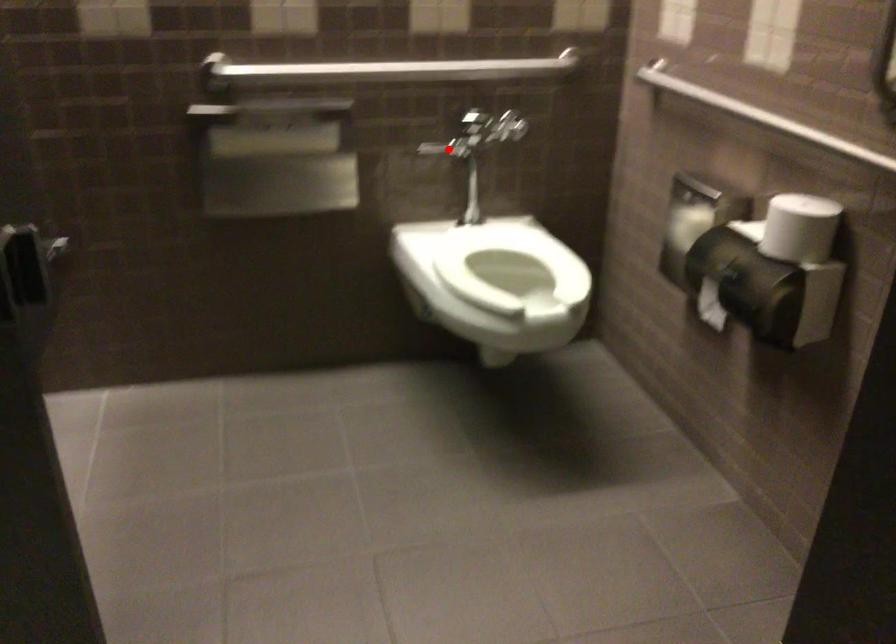
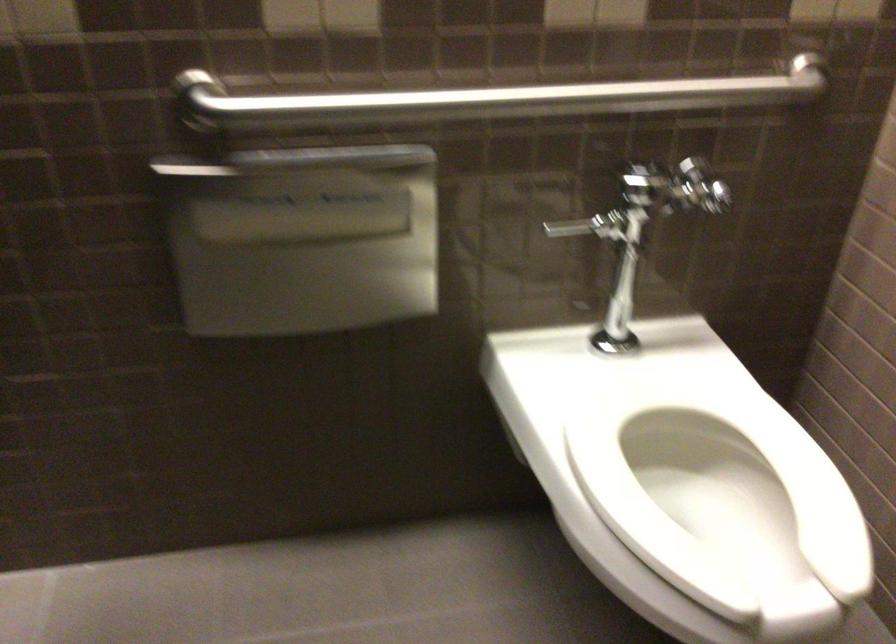
In the second image, find the point that corresponds to the highlighted location in the first image.

(589, 225)